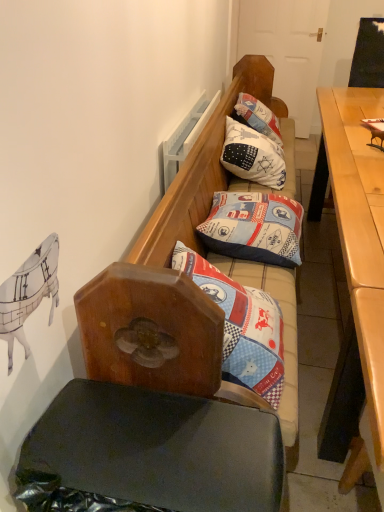
Question: Which direction should I rotate to look at patchwork fabric pillow at center, which appears as the second pillow when viewed from the back, — up or down?

Choices:
 (A) up
 (B) down

Answer: (A)

Question: Is patchwork fabric pillow at upper center, acting as the first pillow starting from the top, far from wooden bench with patterned cushions at center?

Choices:
 (A) yes
 (B) no

Answer: (A)

Question: Considering the relative positions of patchwork fabric pillow at upper center, acting as the first pillow starting from the top, and wooden bench with patterned cushions at center in the image provided, is patchwork fabric pillow at upper center, acting as the first pillow starting from the top, in front of wooden bench with patterned cushions at center?

Choices:
 (A) yes
 (B) no

Answer: (B)

Question: From a real-world perspective, is patchwork fabric pillow at upper center, the 2th pillow in the bottom-to-top sequence, physically below wooden bench with patterned cushions at center?

Choices:
 (A) no
 (B) yes

Answer: (A)

Question: From the image's perspective, is patchwork fabric pillow at upper center, the second pillow when ordered from front to back, on top of wooden bench with patterned cushions at center?

Choices:
 (A) yes
 (B) no

Answer: (A)

Question: Does patchwork fabric pillow at upper center, the 1th pillow when ordered from back to front, have a greater width compared to wooden bench with patterned cushions at center?

Choices:
 (A) yes
 (B) no

Answer: (B)

Question: Is patchwork fabric pillow at upper center, acting as the first pillow starting from the top, outside wooden bench with patterned cushions at center?

Choices:
 (A) yes
 (B) no

Answer: (B)

Question: Is patchwork fabric pillow at upper center, the 2th pillow in the bottom-to-top sequence, taller than light brown wooden desk at right?

Choices:
 (A) no
 (B) yes

Answer: (A)

Question: Is patchwork fabric pillow at upper center, the second pillow when ordered from front to back, outside of light brown wooden desk at right?

Choices:
 (A) no
 (B) yes

Answer: (B)

Question: Does patchwork fabric pillow at upper center, the second pillow when ordered from front to back, have a lesser height compared to light brown wooden desk at right?

Choices:
 (A) no
 (B) yes

Answer: (B)

Question: From the image's perspective, is patchwork fabric pillow at upper center, the 2th pillow in the bottom-to-top sequence, below light brown wooden desk at right?

Choices:
 (A) no
 (B) yes

Answer: (A)

Question: Is the position of patchwork fabric pillow at upper center, acting as the first pillow starting from the top, less distant than that of light brown wooden desk at right?

Choices:
 (A) no
 (B) yes

Answer: (A)

Question: Is patchwork fabric pillow at upper center, acting as the first pillow starting from the top, oriented towards light brown wooden desk at right?

Choices:
 (A) yes
 (B) no

Answer: (A)

Question: From a real-world perspective, does patchwork fabric pillow at center, placed as the second pillow when sorted from top to bottom, sit lower than light brown wooden desk at right?

Choices:
 (A) no
 (B) yes

Answer: (A)